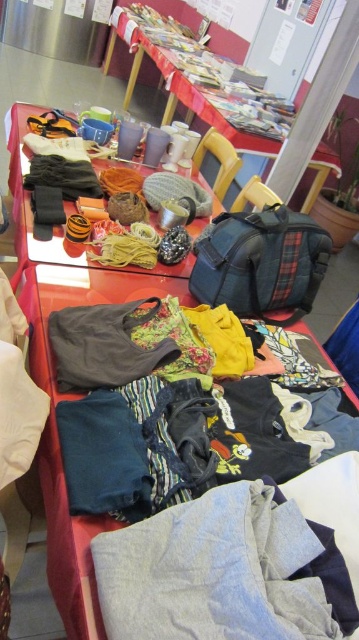
Does yellow fabric chair at center lie behind wooden chair at center?

That is True.

Can you confirm if yellow fabric chair at center is wider than wooden chair at center?

Correct, the width of yellow fabric chair at center exceeds that of wooden chair at center.

Between point (236, 168) and point (258, 189), which one is positioned behind?

Positioned behind is point (236, 168).

You are a GUI agent. You are given a task and a screenshot of the screen. Output one action in this format:
    pyautogui.click(x=<x>, y=<y>)
    Task: Click on the yellow fabric chair at center
    Image resolution: width=359 pixels, height=640 pixels.
    Given the screenshot: What is the action you would take?
    pyautogui.click(x=217, y=160)

Does knitted woolen scarf at center lie behind yellow fabric chair at center?

No, it is in front of yellow fabric chair at center.

Between point (19, 193) and point (216, 134), which one is positioned behind?

Positioned behind is point (216, 134).

The height and width of the screenshot is (640, 359). Identify the location of knitted woolen scarf at center. (19, 177).

Does point (343, 627) come in front of point (227, 154)?

Yes, point (343, 627) is closer to viewer.

Is gray cotton pants at lower center below yellow fabric chair at center?

Correct, gray cotton pants at lower center is located below yellow fabric chair at center.

Is point (100, 563) positioned behind point (218, 179)?

That is False.

Locate an element on the screen. The height and width of the screenshot is (640, 359). gray cotton pants at lower center is located at coordinates (225, 572).